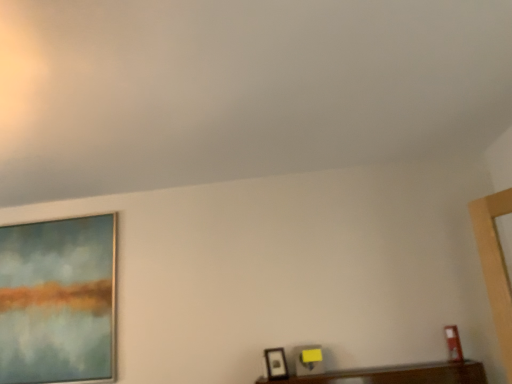
Question: Does matte black picture frame at lower center, arranged as the 2th picture frame when viewed from the back, have a lesser width compared to matte glass painting at left, acting as the third picture frame starting from the right?

Choices:
 (A) yes
 (B) no

Answer: (B)

Question: Is matte glass painting at left, acting as the third picture frame starting from the right, inside matte black picture frame at lower center, positioned as the second picture frame in left-to-right order?

Choices:
 (A) yes
 (B) no

Answer: (B)

Question: Is matte black picture frame at lower center, positioned as the second picture frame in left-to-right order, at the left side of matte glass painting at left, acting as the third picture frame starting from the right?

Choices:
 (A) yes
 (B) no

Answer: (B)

Question: From a real-world perspective, is matte black picture frame at lower center, the second picture frame positioned from the front, on top of matte glass painting at left, which is the 1th picture frame from back to front?

Choices:
 (A) yes
 (B) no

Answer: (B)

Question: Does matte black picture frame at lower center, the second picture frame from the right, have a greater height compared to matte glass painting at left, positioned as the first picture frame in left-to-right order?

Choices:
 (A) yes
 (B) no

Answer: (B)

Question: From the image's perspective, relative to matte glass painting at left, which is the 1th picture frame from back to front, is matte black picture frame at lower right, the 1th picture frame from the right, above or below?

Choices:
 (A) below
 (B) above

Answer: (A)

Question: Is point (444, 327) closer or farther from the camera than point (33, 273)?

Choices:
 (A) closer
 (B) farther

Answer: (A)

Question: Choose the correct answer: Is matte black picture frame at lower right, the 3th picture frame positioned from the back, inside matte glass painting at left, acting as the third picture frame starting from the right, or outside it?

Choices:
 (A) outside
 (B) inside

Answer: (A)

Question: From a real-world perspective, is matte black picture frame at lower right, which is counted as the third picture frame, starting from the left, above or below matte glass painting at left, which is the 1th picture frame from back to front?

Choices:
 (A) above
 (B) below

Answer: (B)

Question: Which is correct: matte black picture frame at lower center, positioned as the second picture frame in left-to-right order, is inside matte glass painting at left, acting as the third picture frame starting from the right, or outside of it?

Choices:
 (A) inside
 (B) outside

Answer: (B)

Question: Does point (268, 357) appear closer or farther from the camera than point (25, 294)?

Choices:
 (A) closer
 (B) farther

Answer: (A)

Question: From a real-world perspective, is matte black picture frame at lower center, the second picture frame from the right, physically located above or below matte glass painting at left, which is the 1th picture frame from back to front?

Choices:
 (A) below
 (B) above

Answer: (A)

Question: From the image's perspective, is matte black picture frame at lower center, positioned as the second picture frame in left-to-right order, located above or below matte glass painting at left, which is counted as the 3th picture frame, starting from the front?

Choices:
 (A) below
 (B) above

Answer: (A)

Question: Is point (31, 294) positioned closer to the camera than point (448, 347)?

Choices:
 (A) farther
 (B) closer

Answer: (A)

Question: From the image's perspective, is matte glass painting at left, which is the 1th picture frame from back to front, located above or below matte black picture frame at lower right, the 3th picture frame positioned from the back?

Choices:
 (A) below
 (B) above

Answer: (B)